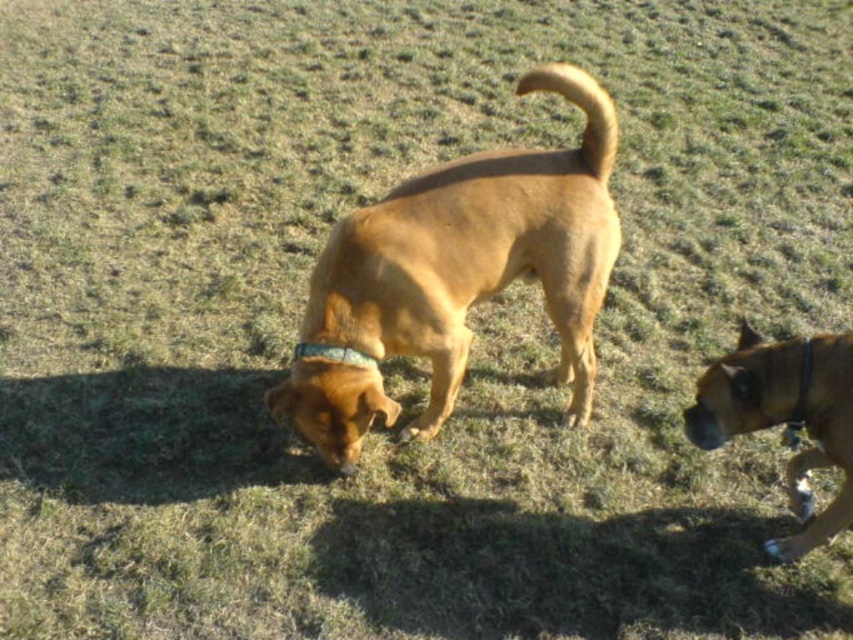
Question: Among these points, which one is nearest to the camera?

Choices:
 (A) (561, 371)
 (B) (842, 371)

Answer: (B)

Question: Does brown matte dog at center have a smaller size compared to brown leather dog at center?

Choices:
 (A) yes
 (B) no

Answer: (B)

Question: Which point is closer to the camera?

Choices:
 (A) brown matte dog at center
 (B) brown leather dog at center

Answer: (B)

Question: Observing the image, what is the correct spatial positioning of brown matte dog at center in reference to brown leather dog at center?

Choices:
 (A) above
 (B) below

Answer: (A)

Question: Which point is closer to the camera?

Choices:
 (A) (381, 276)
 (B) (740, 417)

Answer: (B)

Question: Does brown matte dog at center appear on the left side of brown leather dog at center?

Choices:
 (A) no
 (B) yes

Answer: (B)